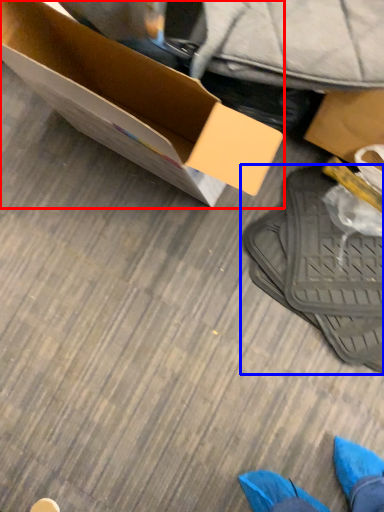
Question: Which object appears closest to the camera in this image, box (highlighted by a red box) or footwear (highlighted by a blue box)?

Choices:
 (A) box
 (B) footwear

Answer: (A)